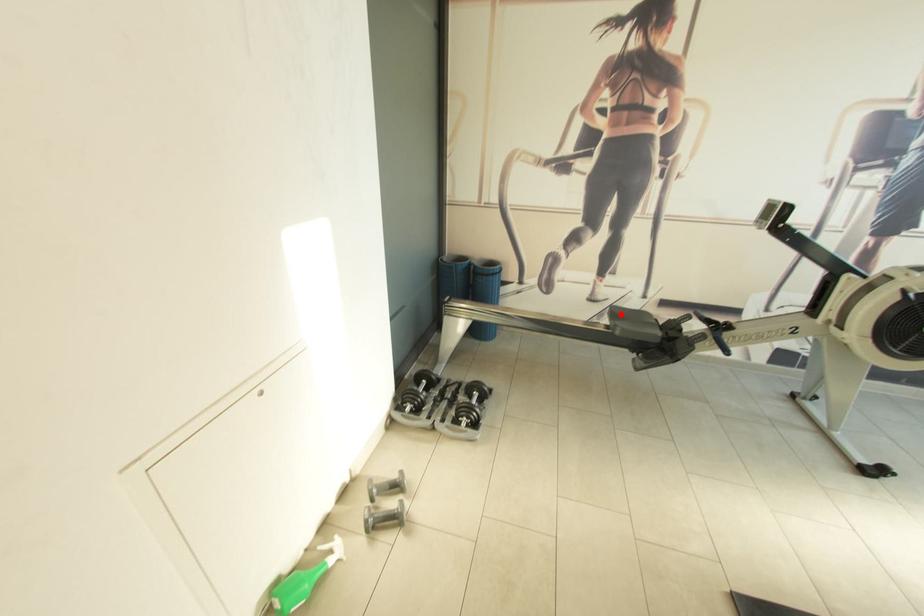
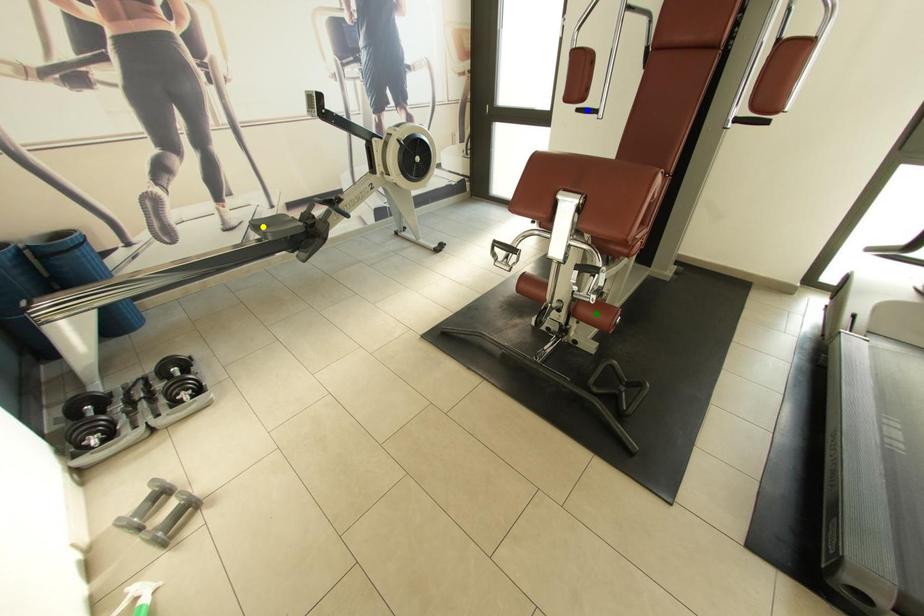
Question: I am providing you with two images of the same scene from different viewpoints. A red point is marked on the first image. You are given multiple points on the second image. Can you choose the point in image 2 that corresponds to the point in image 1?

Choices:
 (A) blue point
 (B) green point
 (C) yellow point

Answer: (C)